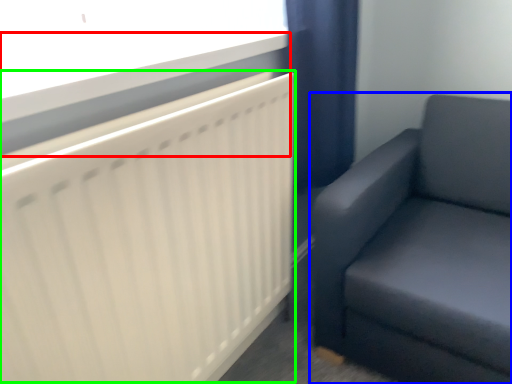
Question: Estimate the real-world distances between objects in this image. Which object is closer to window sill (highlighted by a red box), studio couch (highlighted by a blue box) or radiator (highlighted by a green box)?

Choices:
 (A) studio couch
 (B) radiator

Answer: (B)